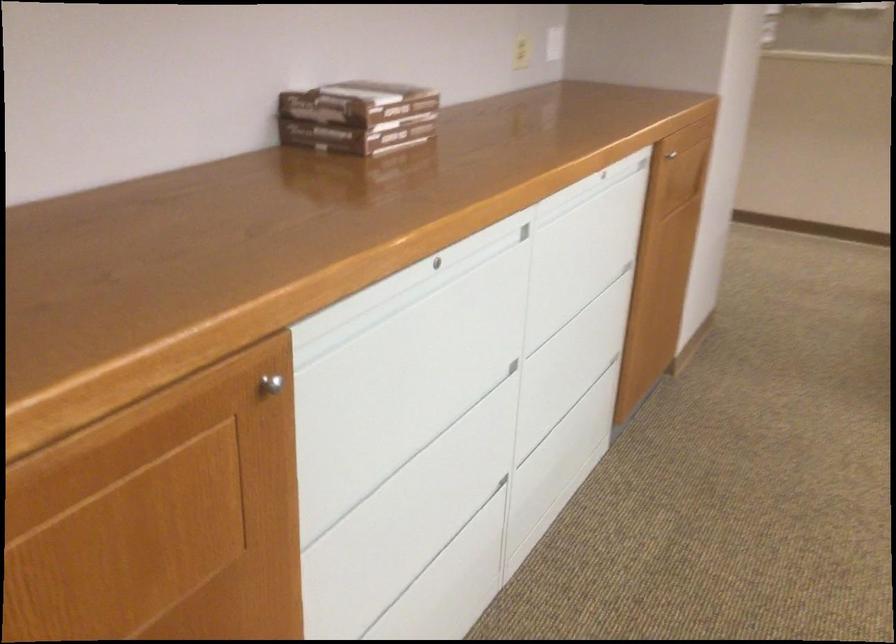
Find the location of a particular element. The height and width of the screenshot is (644, 896). drawer keyhole is located at coordinates [435, 261].